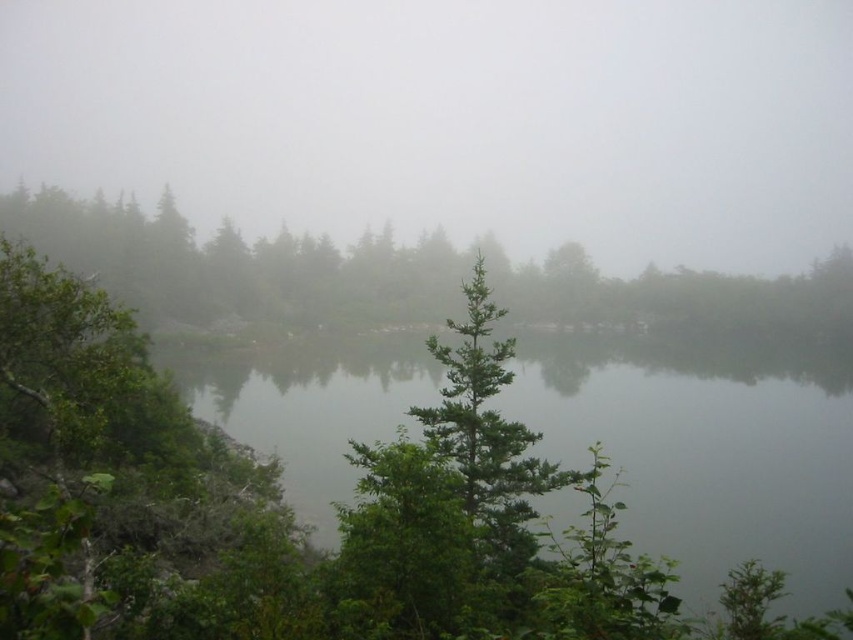
Question: Where is foggy atmosphere at upper center located in relation to green leafy water at center in the image?

Choices:
 (A) above
 (B) below

Answer: (A)

Question: Estimate the real-world distances between objects in this image. Which object is closer to the foggy atmosphere at upper center?

Choices:
 (A) green matte tree at upper left
 (B) green leafy water at center

Answer: (A)

Question: Which point appears farthest from the camera in this image?

Choices:
 (A) click(x=425, y=266)
 (B) click(x=222, y=216)

Answer: (B)

Question: Does foggy atmosphere at upper center appear on the right side of green leafy water at center?

Choices:
 (A) yes
 (B) no

Answer: (B)

Question: Is green leafy water at center further to camera compared to green matte tree at upper left?

Choices:
 (A) yes
 (B) no

Answer: (B)

Question: Which point is closer to the camera?

Choices:
 (A) green leafy water at center
 (B) foggy atmosphere at upper center
 (C) green matte tree at upper left

Answer: (A)